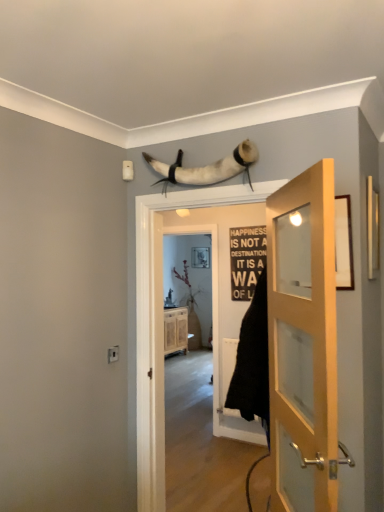
Based on the photo, how much space does white wooden door at center, which appears as the 1th door when viewed from the back, occupy horizontally?

It is 7.07 inches.

Where is `white wooden door at center, which appears as the 1th door when viewed from the back`? This screenshot has height=512, width=384. white wooden door at center, which appears as the 1th door when viewed from the back is located at coordinates (304, 340).

Where is `matte black picture frame at upper center`? matte black picture frame at upper center is located at coordinates (200, 257).

Where is `white leather horns at upper center`? Image resolution: width=384 pixels, height=512 pixels. white leather horns at upper center is located at coordinates (206, 167).

Looking at this image, from a real-world perspective, is matte black picture frame at upper center positioned above or below wooden cabinet at center?

Clearly, from a real-world perspective, matte black picture frame at upper center is above wooden cabinet at center.

Between matte black picture frame at upper center and wooden cabinet at center, which one has larger size?

With larger size is wooden cabinet at center.

Is wooden cabinet at center inside matte black picture frame at upper center?

That's incorrect, wooden cabinet at center is not inside matte black picture frame at upper center.

Considering the relative sizes of wooden cabinet at center and white wooden door at center, which is the second door in front-to-back order, in the image provided, is wooden cabinet at center taller than white wooden door at center, which is the second door in front-to-back order,?

In fact, wooden cabinet at center may be shorter than white wooden door at center, which is the second door in front-to-back order.

Is point (171, 320) closer or farther from the camera than point (305, 304)?

Point (171, 320).

Is wooden cabinet at center in front of white wooden door at center, arranged as the first door when viewed from the left?

No, wooden cabinet at center is further to the viewer.

Could you tell me if wooden cabinet at center is facing white wooden door at center, arranged as the first door when viewed from the left?

No.

Where is `door below the wooden door at right, the second door in the left-to-right sequence (from a real-world perspective)`? The image size is (384, 512). door below the wooden door at right, the second door in the left-to-right sequence (from a real-world perspective) is located at coordinates (304, 340).

Can you see white wooden door at center, which appears as the 1th door when viewed from the back, touching wooden door at right, which is counted as the 2th door, starting from the back?

Yes, white wooden door at center, which appears as the 1th door when viewed from the back, is with wooden door at right, which is counted as the 2th door, starting from the back.

In terms of width, does white wooden door at center, which is the second door in front-to-back order, look wider or thinner when compared to wooden door at right, the second door in the left-to-right sequence?

Considering their sizes, white wooden door at center, which is the second door in front-to-back order, looks broader than wooden door at right, the second door in the left-to-right sequence.

From a real-world perspective, is white wooden door at center, which appears as the 1th door when viewed from the back, physically below wooden door at right, the second door in the left-to-right sequence?

Yes, from a real-world perspective, white wooden door at center, which appears as the 1th door when viewed from the back, is beneath wooden door at right, the second door in the left-to-right sequence.

Is point (195, 262) less distant than point (298, 250)?

That is False.

From the picture: Is matte black picture frame at upper center oriented towards wooden door at right, marked as the first door in a front-to-back arrangement?

No, matte black picture frame at upper center is not turned towards wooden door at right, marked as the first door in a front-to-back arrangement.

From a real-world perspective, is matte black picture frame at upper center beneath wooden door at right, the second door in the left-to-right sequence?

Incorrect, from a real-world perspective, matte black picture frame at upper center is higher than wooden door at right, the second door in the left-to-right sequence.

Is matte black picture frame at upper center positioned far away from wooden door at right, placed as the first door when sorted from right to left?

matte black picture frame at upper center is far away from wooden door at right, placed as the first door when sorted from right to left.

From a real-world perspective, is white leather horns at upper center on top of wooden cabinet at center?

Yes, from a real-world perspective, white leather horns at upper center is on top of wooden cabinet at center.

Can you tell me how much white leather horns at upper center and wooden cabinet at center differ in facing direction?

They differ by 62.2 degrees in their facing directions.

From the image's perspective, which object appears higher, white leather horns at upper center or wooden cabinet at center?

white leather horns at upper center.

Which object is positioned more to the left, white leather horns at upper center or wooden cabinet at center?

From the viewer's perspective, wooden cabinet at center appears more on the left side.

How different are the orientations of matte black picture frame at upper center and white leather horns at upper center in degrees?

matte black picture frame at upper center and white leather horns at upper center are facing 0.429 degrees away from each other.

From the image's perspective, is matte black picture frame at upper center over white leather horns at upper center?

No.

Is matte black picture frame at upper center far away from white leather horns at upper center?

Absolutely, matte black picture frame at upper center is distant from white leather horns at upper center.

Identify the location of animal above the matte black picture frame at upper center (from the image's perspective). (206, 167).

Is point (206, 179) behind point (193, 261)?

No, (206, 179) is in front of (193, 261).

Can you confirm if white leather horns at upper center is smaller than matte black picture frame at upper center?

No, white leather horns at upper center is not smaller than matte black picture frame at upper center.

From the image's perspective, relative to matte black picture frame at upper center, is white leather horns at upper center above or below?

From the image's perspective, white leather horns at upper center appears above matte black picture frame at upper center.

The height and width of the screenshot is (512, 384). I want to click on picture frame on the right of the wooden cabinet at center, so click(x=200, y=257).

Identify the location of cabinetry directly beneath the white wooden door at center, arranged as the first door when viewed from the left (from a real-world perspective). (175, 330).

When comparing their distances from matte black picture frame at upper center, does white wooden door at center, which appears as the 1th door when viewed from the back, or wooden door at right, placed as the first door when sorted from right to left, seem further?

wooden door at right, placed as the first door when sorted from right to left, lies further to matte black picture frame at upper center than the other object.

Which object lies further to the anchor point wooden door at right, which is counted as the 2th door, starting from the back, matte black picture frame at upper center or white leather horns at upper center?

matte black picture frame at upper center.

Which object lies nearer to the anchor point white leather horns at upper center, wooden cabinet at center or wooden door at right, which is counted as the 2th door, starting from the back?

Among the two, wooden door at right, which is counted as the 2th door, starting from the back, is located nearer to white leather horns at upper center.

Considering their positions, is wooden cabinet at center positioned closer to wooden door at right, placed as the first door when sorted from right to left, than white leather horns at upper center?

white leather horns at upper center is closer to wooden door at right, placed as the first door when sorted from right to left.

Looking at the image, which one is located further to wooden door at right, placed as the first door when sorted from right to left, matte black picture frame at upper center or wooden cabinet at center?

matte black picture frame at upper center is positioned further to the anchor wooden door at right, placed as the first door when sorted from right to left.

Which object lies nearer to the anchor point matte black picture frame at upper center, wooden cabinet at center or white wooden door at center, the 2th door when ordered from right to left?

wooden cabinet at center is positioned closer to the anchor matte black picture frame at upper center.

Based on their spatial positions, is wooden door at right, marked as the first door in a front-to-back arrangement, or white wooden door at center, the 2th door when ordered from right to left, further from matte black picture frame at upper center?

Among the two, wooden door at right, marked as the first door in a front-to-back arrangement, is located further to matte black picture frame at upper center.

When comparing their distances from wooden cabinet at center, does white wooden door at center, arranged as the first door when viewed from the left, or matte black picture frame at upper center seem closer?

Based on the image, matte black picture frame at upper center appears to be nearer to wooden cabinet at center.

Locate an element on the screen. The height and width of the screenshot is (512, 384). door between wooden door at right, placed as the first door when sorted from right to left, and matte black picture frame at upper center in the front-back direction is located at coordinates (304, 340).

Find the location of a particular element. Image resolution: width=384 pixels, height=512 pixels. door between white leather horns at upper center and wooden cabinet at center from front to back is located at coordinates (304, 340).

Locate an element on the screen. The height and width of the screenshot is (512, 384). cabinetry between white leather horns at upper center and matte black picture frame at upper center from front to back is located at coordinates (175, 330).

In order to click on cabinetry between white wooden door at center, arranged as the first door when viewed from the left, and matte black picture frame at upper center in the front-back direction in this screenshot , I will do `click(175, 330)`.